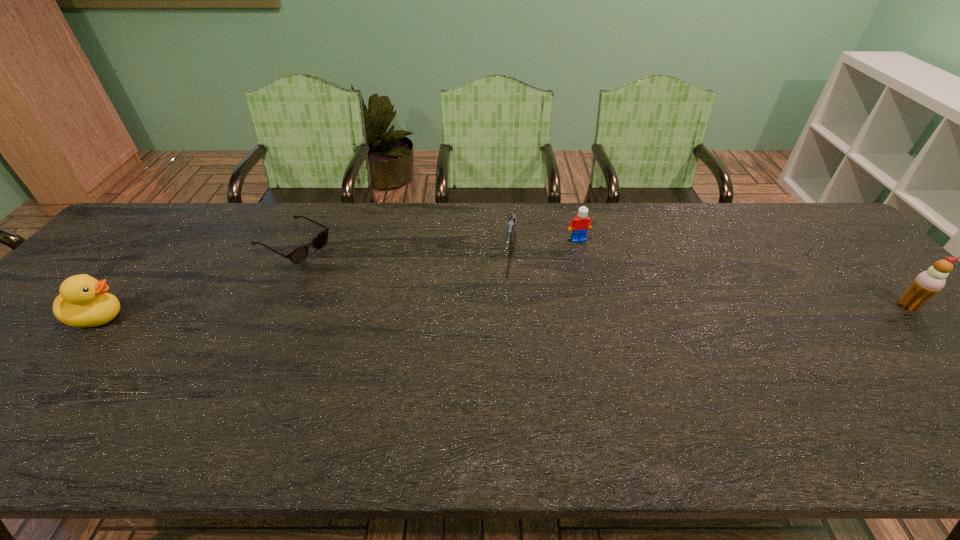
Locate an element on the screen. This screenshot has width=960, height=540. object that is the second closest one to the rightmost object is located at coordinates (512, 220).

Identify the location of vacant region that satisfies the following two spatial constraints: 1. on the front side of the gun; 2. on the right side of the fourth object from right to left. This screenshot has width=960, height=540. (290, 253).